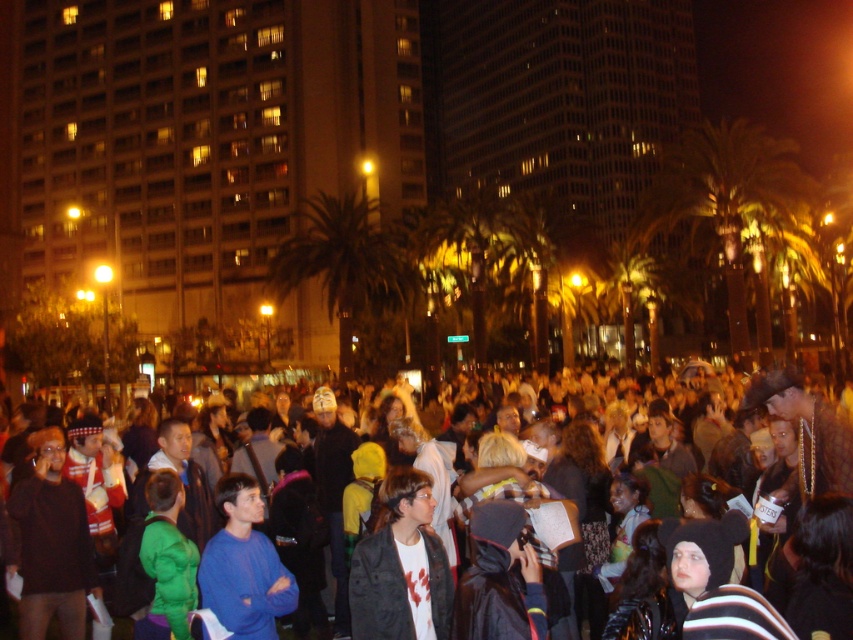
Question: Which point appears farthest from the camera in this image?

Choices:
 (A) pyautogui.click(x=234, y=477)
 (B) pyautogui.click(x=766, y=180)

Answer: (B)

Question: Which point is closer to the camera taking this photo?

Choices:
 (A) (743, 460)
 (B) (440, 570)
 (C) (254, 588)

Answer: (C)

Question: Does green leafy palm tree at right appear over green leafy palm tree at center?

Choices:
 (A) yes
 (B) no

Answer: (A)

Question: Is green leafy palm tree at right wider than green leafy palm tree at center?

Choices:
 (A) yes
 (B) no

Answer: (A)

Question: Is green leafy palm tree at right closer to camera compared to matte black jacket at center?

Choices:
 (A) no
 (B) yes

Answer: (A)

Question: Considering the real-world distances, which object is farthest from the green leafy palm tree at center?

Choices:
 (A) dark blue hoodie at center
 (B) blue fleece jacket at center
 (C) matte black jacket at center

Answer: (C)